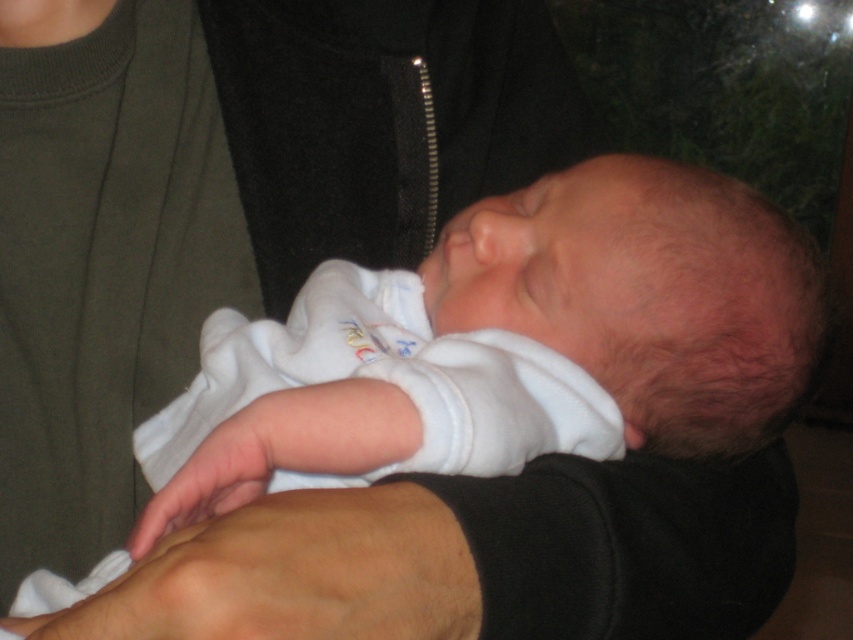
Question: Is white soft fabric at center behind smooth skin hand at lower center?

Choices:
 (A) yes
 (B) no

Answer: (B)

Question: Which object appears farthest from the camera in this image?

Choices:
 (A) white soft fabric at center
 (B) smooth skin hand at lower center
 (C) white soft fabric newborn at center

Answer: (C)

Question: Among these points, which one is farthest from the camera?

Choices:
 (A) (x=323, y=618)
 (B) (x=718, y=422)
 (C) (x=370, y=609)

Answer: (B)

Question: Can you confirm if white soft fabric newborn at center is positioned below white soft fabric at center?

Choices:
 (A) no
 (B) yes

Answer: (A)

Question: Does white soft fabric newborn at center appear under white soft fabric at center?

Choices:
 (A) no
 (B) yes

Answer: (A)

Question: Which of the following is the closest to the observer?

Choices:
 (A) (624, 460)
 (B) (450, 628)

Answer: (B)